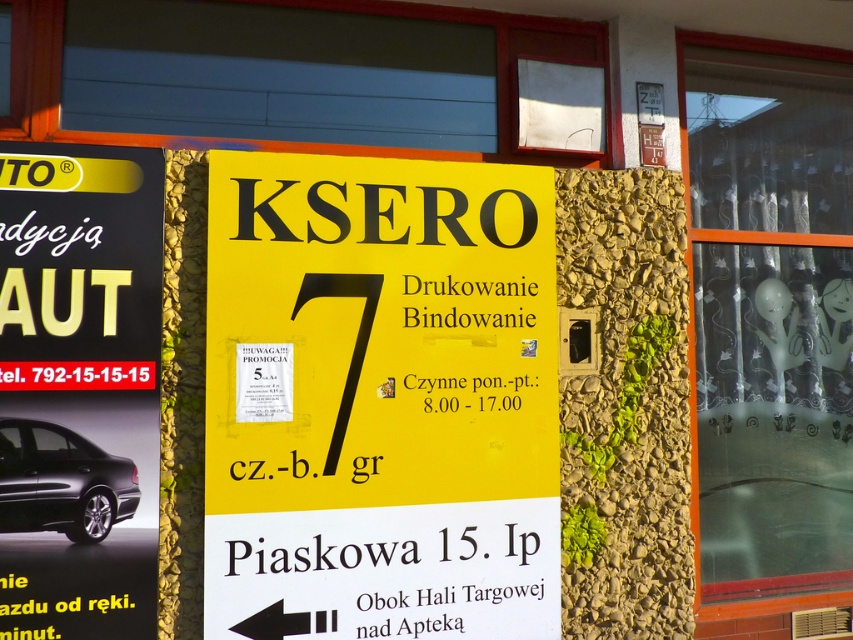
You are standing in front of the yellow signboard on the stone wall. There are two points marked on the signboard. One is at position point (403,304) and the other at point (90,486). Which point is closer to you?

Point (90,486) is closer to you because it is in front of point (403,304).

You are driving a car that is exactly 2.5 inches wide and want to park it in a space between the black glossy car at left and the yellow matte sign at left. Can your car fit in that space?

The space between the black glossy car at left and the yellow matte sign at left is 2.51 inches, which is slightly wider than your car. Therefore, your car can fit in that space.